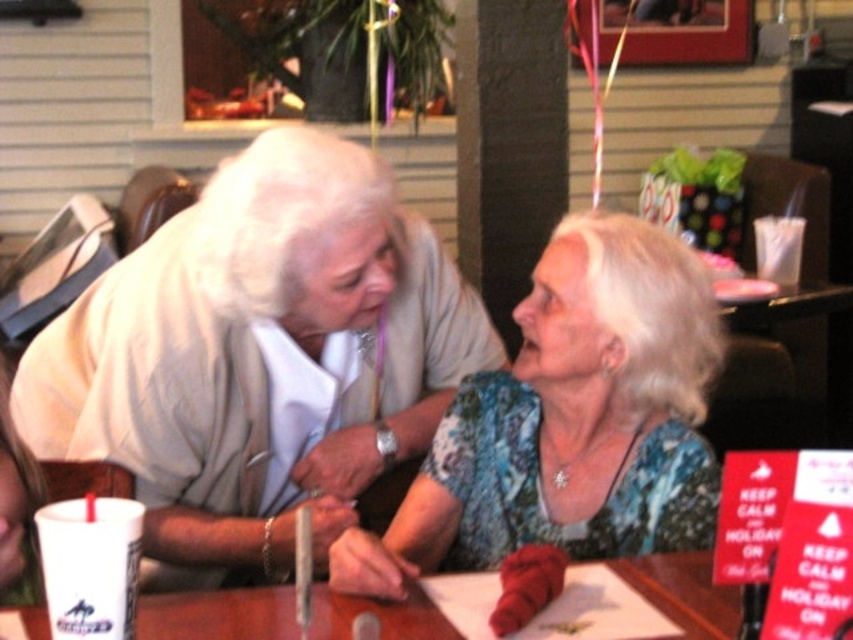
Does matte white blouse at center appear on the right side of brown wooden table at center?

Correct, you'll find matte white blouse at center to the right of brown wooden table at center.

Does point (157, 460) come in front of point (685, 570)?

No, (157, 460) is further to viewer.

I want to click on matte white blouse at center, so click(259, 356).

Between matte white blouse at center and floral-patterned blouse at center, which one is positioned higher?

Positioned higher is matte white blouse at center.

Is matte white blouse at center positioned in front of floral-patterned blouse at center?

No, matte white blouse at center is behind floral-patterned blouse at center.

Identify the location of matte white blouse at center. (259, 356).

In the scene shown: Is floral-patterned blouse at center further to camera compared to brown wooden table at center?

That is True.

Is the position of floral-patterned blouse at center less distant than that of brown wooden table at center?

No, floral-patterned blouse at center is further to the viewer.

Which is in front, point (677, 301) or point (384, 604)?

Point (384, 604) is in front.

Locate an element on the screen. The height and width of the screenshot is (640, 853). floral-patterned blouse at center is located at coordinates (570, 420).